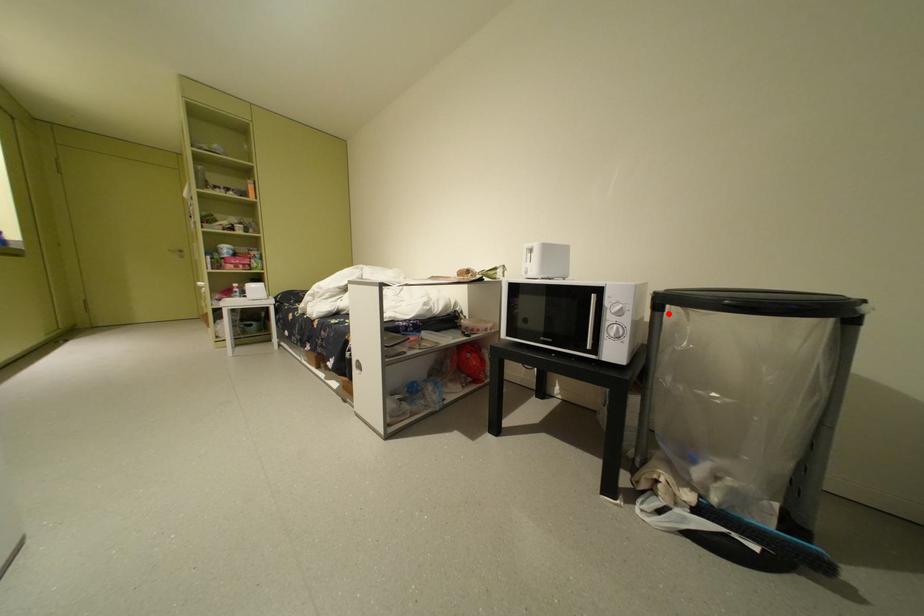
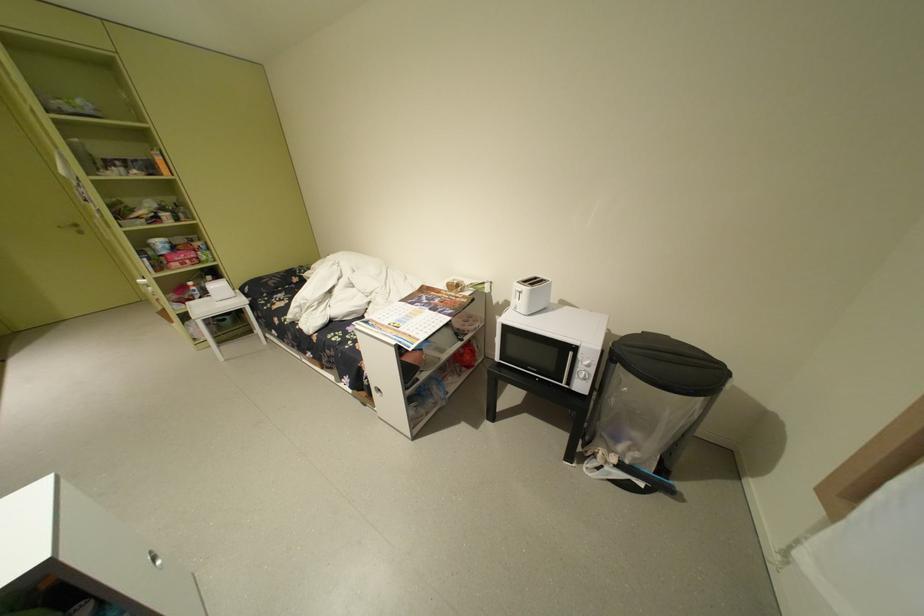
Where in the second image is the point corresponding to the highlighted location from the first image?

(624, 365)